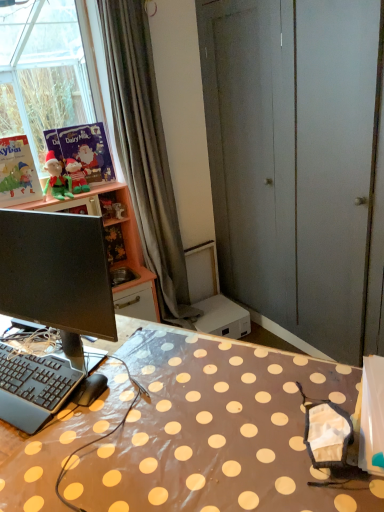
What are the coordinates of `vacant area situated to the left side of black rubberized computer mouse at lower left` in the screenshot? It's located at (36, 415).